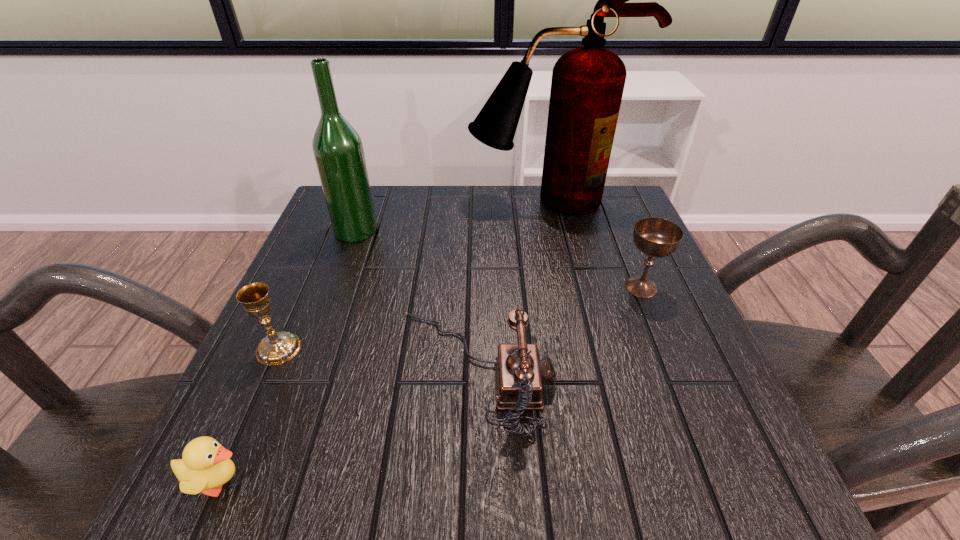
At what (x,y) coordinates should I click in order to perform the action: click on free location at the left edge of the desktop. Please return your answer as a coordinate pair (x, y). The width and height of the screenshot is (960, 540). Looking at the image, I should click on (234, 404).

Locate an element on the screen. free space at the right edge of the desktop is located at coordinates (630, 252).

This screenshot has width=960, height=540. I want to click on vacant space at the far left corner of the desktop, so click(380, 207).

This screenshot has height=540, width=960. I want to click on free spot at the far right corner of the desktop, so click(585, 228).

Image resolution: width=960 pixels, height=540 pixels. I want to click on free area in between the left chalice and the fire extinguisher, so click(413, 274).

You are a GUI agent. You are given a task and a screenshot of the screen. Output one action in this format:
    pyautogui.click(x=<x>, y=<y>)
    Task: Click on the vacant space in between the duckling and the nearer chalice
    The width and height of the screenshot is (960, 540).
    Given the screenshot: What is the action you would take?
    pyautogui.click(x=249, y=415)

Where is `vacant point located between the nearest object and the farthest object`? The height and width of the screenshot is (540, 960). vacant point located between the nearest object and the farthest object is located at coordinates (384, 341).

Identify the location of free space between the left chalice and the second tallest object. The width and height of the screenshot is (960, 540). (317, 289).

Where is `blank region between the left chalice and the telephone`? The height and width of the screenshot is (540, 960). blank region between the left chalice and the telephone is located at coordinates (376, 360).

Locate an element on the screen. This screenshot has height=540, width=960. vacant space that's between the fifth nearest object and the nearer chalice is located at coordinates (317, 289).